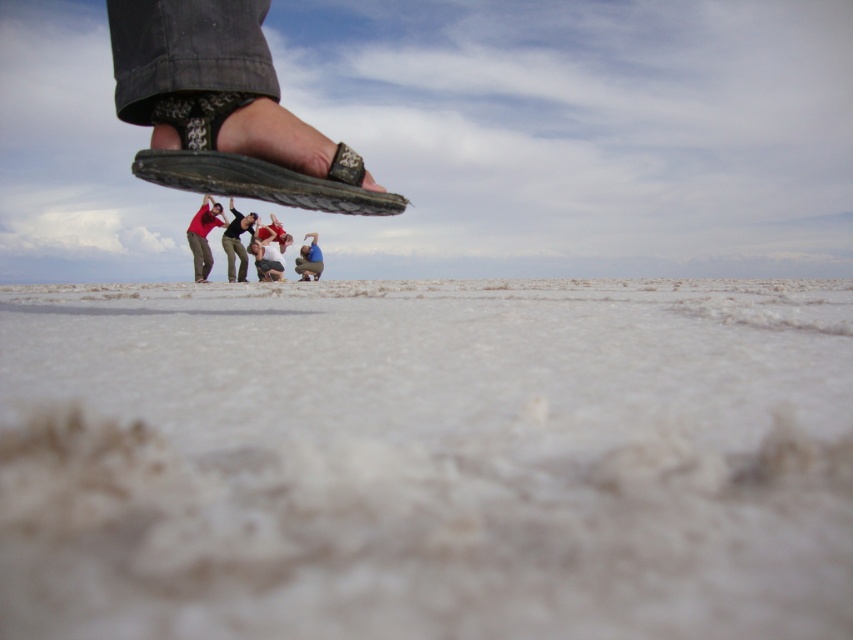
Between dark gray pants at lower center and matte blue shirt at lower center, which one is positioned higher?

dark gray pants at lower center

Between dark gray pants at lower center and matte blue shirt at lower center, which one is positioned lower?

Positioned lower is matte blue shirt at lower center.

The image size is (853, 640). Describe the element at coordinates (236, 243) in the screenshot. I see `dark gray pants at lower center` at that location.

Where is `dark gray pants at lower center`? dark gray pants at lower center is located at coordinates (236, 243).

Can you confirm if black leather sandal at upper center is positioned above matte red shirt at center?

Actually, black leather sandal at upper center is below matte red shirt at center.

Does black leather sandal at upper center have a lesser width compared to matte red shirt at center?

Indeed, black leather sandal at upper center has a lesser width compared to matte red shirt at center.

Locate an element on the screen. black leather sandal at upper center is located at coordinates 265,180.

What are the coordinates of `black leather sandal at upper center` in the screenshot? It's located at (265, 180).

Which is more to the right, matte red shirt at upper center or matte blue shirt at lower center?

Positioned to the right is matte blue shirt at lower center.

Does matte red shirt at upper center have a greater height compared to matte blue shirt at lower center?

Yes.

Does point (209, 262) come farther from viewer compared to point (318, 272)?

No, (209, 262) is closer to viewer.

Where is `matte red shirt at upper center`? The height and width of the screenshot is (640, 853). matte red shirt at upper center is located at coordinates (202, 236).